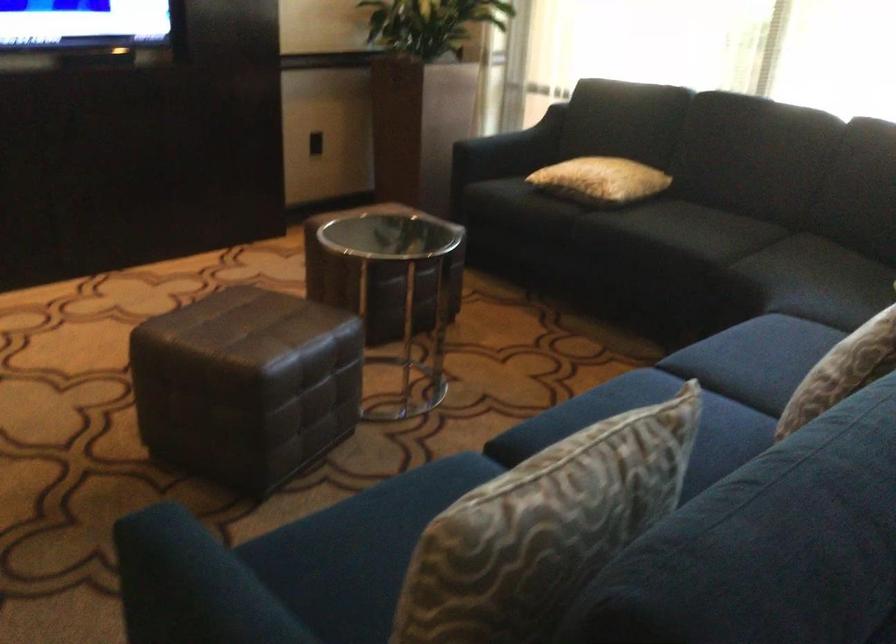
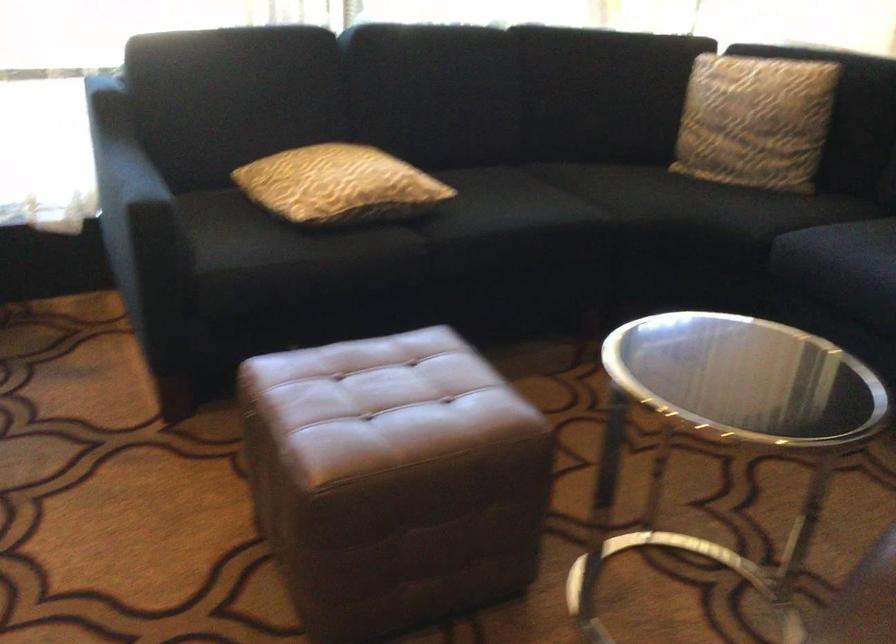
Locate, in the second image, the point that corresponds to (604,214) in the first image.

(426, 227)